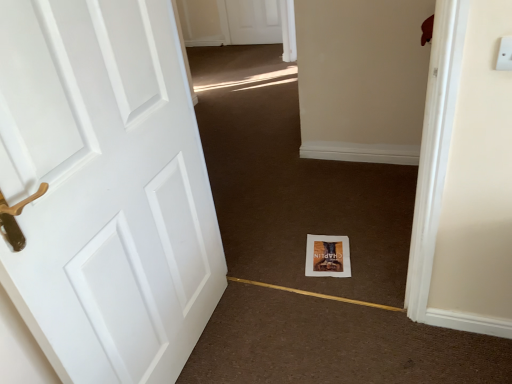
Locate an element on the screen. Image resolution: width=512 pixels, height=384 pixels. free location in front of matte paper book at center is located at coordinates (352, 284).